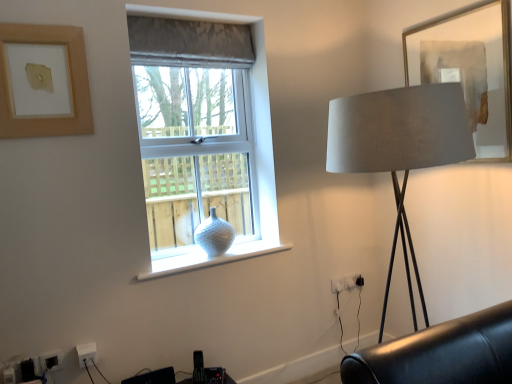
Question: Considering their positions, is white plastic electric outlet at lower right, the 2th electric outlet positioned from the front, located in front of or behind white textured vase at center?

Choices:
 (A) front
 (B) behind

Answer: (B)

Question: From the image's perspective, is white plastic electric outlet at lower right, the 2th electric outlet from the right, positioned above or below white textured vase at center?

Choices:
 (A) above
 (B) below

Answer: (B)

Question: Which is farther from the matte silver picture frame at upper right, marked as the first picture frame in a right-to-left arrangement?

Choices:
 (A) white plastic electric outlet at lower right, the 2th electric outlet from the right
 (B) white plastic electric outlet at lower left, positioned as the first electric outlet in front-to-back order
 (C) white glossy vase at window
 (D) satin beige lampshade at right
 (E) white plastic electric outlet at lower right, positioned as the first electric outlet in right-to-left order

Answer: (B)

Question: Estimate the real-world distances between objects in this image. Which object is closer to the gray textured fabric curtain at upper center?

Choices:
 (A) white glossy vase at window
 (B) white textured vase at center
 (C) white glossy vase at center
 (D) white plastic electric outlet at lower left, the third electric outlet viewed from the back
 (E) white plastic electric outlet at lower right, the 2th electric outlet in the bottom-to-top sequence

Answer: (B)